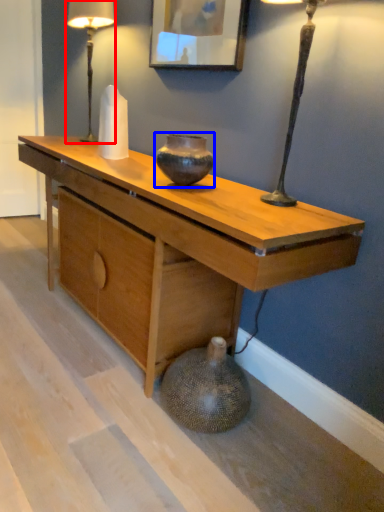
Question: Which object is closer to the camera taking this photo, table lamp (highlighted by a red box) or vase (highlighted by a blue box)?

Choices:
 (A) table lamp
 (B) vase

Answer: (B)